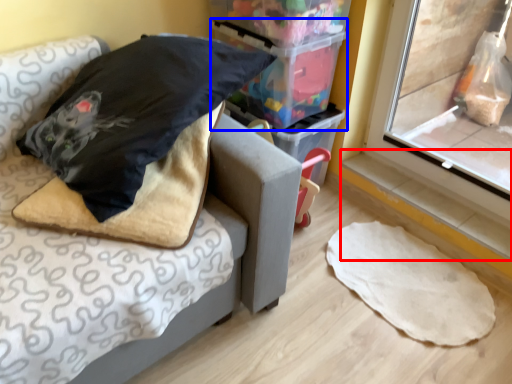
Question: Which object appears farthest to the camera in this image, window sill (highlighted by a red box) or storage box (highlighted by a blue box)?

Choices:
 (A) window sill
 (B) storage box

Answer: (A)